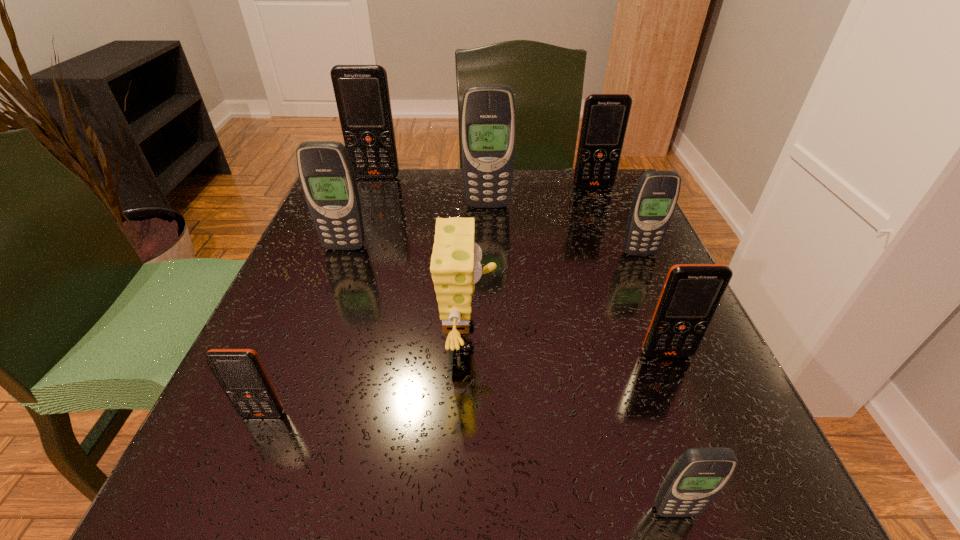
In the image, there is a desktop. Identify the location of free space at the right edge. [x=595, y=247].

Locate an element on the screen. free space that is in between the second gray cellular telephone from right to left and the third biggest orange cellular telephone is located at coordinates (671, 433).

Image resolution: width=960 pixels, height=540 pixels. In order to click on free space between the second smallest orange cellular telephone and the rightmost gray cellular telephone in this screenshot , I will do `click(653, 303)`.

Where is `vacant point located between the biggest orange cellular telephone and the eighth farthest object`? vacant point located between the biggest orange cellular telephone and the eighth farthest object is located at coordinates 320,295.

Find the location of a particular element. This screenshot has height=540, width=960. empty space between the third smallest gray cellular telephone and the smallest gray cellular telephone is located at coordinates point(510,379).

Locate an element on the screen. The width and height of the screenshot is (960, 540). free spot between the third nearest cellular telephone and the leftmost gray cellular telephone is located at coordinates (506, 300).

The height and width of the screenshot is (540, 960). In order to click on empty space that is in between the third biggest gray cellular telephone and the third nearest cellular telephone in this screenshot , I will do `click(653, 303)`.

In order to click on blank region between the second nearest orange cellular telephone and the leftmost gray cellular telephone in this screenshot , I will do `click(506, 300)`.

Point out which object is positioned as the fifth nearest to the farthest orange cellular telephone. Please provide its 2D coordinates. Your answer should be formatted as a tuple, i.e. [(x, y)], where the tuple contains the x and y coordinates of a point satisfying the conditions above.

[(656, 195)]

You are a GUI agent. You are given a task and a screenshot of the screen. Output one action in this format:
    pyautogui.click(x=<x>, y=<y>)
    Task: Click on the object identified as the fifth closest to the second nearest object
    Image resolution: width=960 pixels, height=540 pixels.
    Given the screenshot: What is the action you would take?
    pyautogui.click(x=488, y=115)